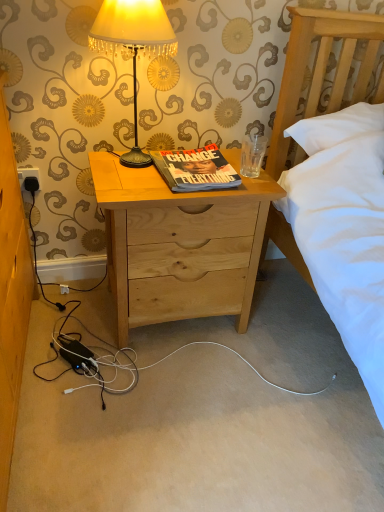
Question: From the image's perspective, does natural wood nightstand at center appear higher than black plastic power outlet at lower left?

Choices:
 (A) no
 (B) yes

Answer: (A)

Question: Can black plastic power outlet at lower left be found inside natural wood nightstand at center?

Choices:
 (A) yes
 (B) no

Answer: (B)

Question: Is natural wood nightstand at center positioned far away from black plastic power outlet at lower left?

Choices:
 (A) yes
 (B) no

Answer: (B)

Question: Is natural wood nightstand at center at the right side of black plastic power outlet at lower left?

Choices:
 (A) no
 (B) yes

Answer: (B)

Question: From a real-world perspective, is natural wood nightstand at center positioned under black plastic power outlet at lower left based on gravity?

Choices:
 (A) yes
 (B) no

Answer: (A)

Question: Does natural wood nightstand at center turn towards black plastic power outlet at lower left?

Choices:
 (A) no
 (B) yes

Answer: (A)

Question: From the image's perspective, is black plastic power outlet at lower left located beneath metallic lampshade at upper center?

Choices:
 (A) yes
 (B) no

Answer: (A)

Question: Would you say metallic lampshade at upper center is part of black plastic power outlet at lower left's contents?

Choices:
 (A) yes
 (B) no

Answer: (B)

Question: Does black plastic power outlet at lower left have a smaller size compared to metallic lampshade at upper center?

Choices:
 (A) no
 (B) yes

Answer: (B)

Question: Is black plastic power outlet at lower left far away from metallic lampshade at upper center?

Choices:
 (A) yes
 (B) no

Answer: (B)

Question: Is black plastic power outlet at lower left wider than metallic lampshade at upper center?

Choices:
 (A) no
 (B) yes

Answer: (A)

Question: Is black plastic power outlet at lower left thinner than metallic lampshade at upper center?

Choices:
 (A) no
 (B) yes

Answer: (B)

Question: Is natural wood nightstand at center with hardcover book at center?

Choices:
 (A) no
 (B) yes

Answer: (A)